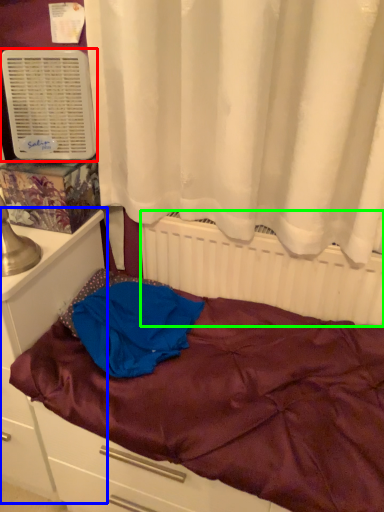
Question: Based on their relative distances, which object is nearer to air conditioning (highlighted by a red box)? Choose from file cabinet (highlighted by a blue box) and radiator (highlighted by a green box).

Choices:
 (A) file cabinet
 (B) radiator

Answer: (A)